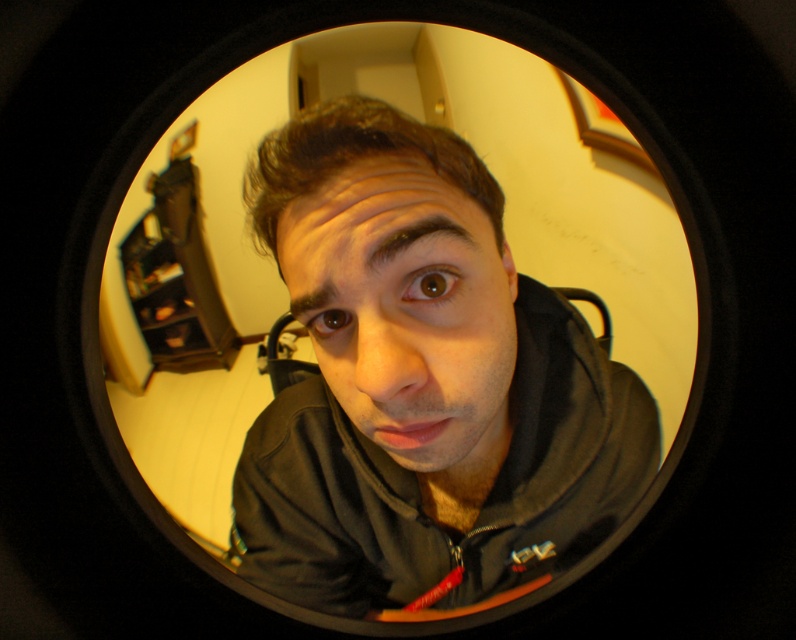
Is matte black hoodie at center shorter than smooth skin face at center?

In fact, matte black hoodie at center may be taller than smooth skin face at center.

This screenshot has height=640, width=796. Identify the location of matte black hoodie at center. (420, 381).